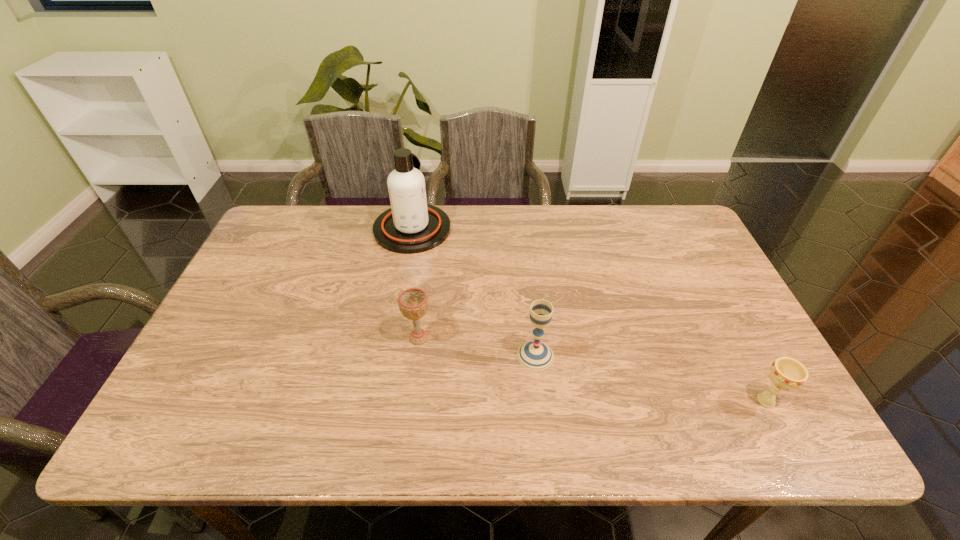
At what (x,y) coordinates should I click in order to perform the action: click on object present at the far edge. Please return your answer as a coordinate pair (x, y). The width and height of the screenshot is (960, 540). Looking at the image, I should click on (410, 226).

The height and width of the screenshot is (540, 960). What are the coordinates of `object that is positioned at the near edge` in the screenshot? It's located at (786, 373).

This screenshot has width=960, height=540. What are the coordinates of `object present at the right edge` in the screenshot? It's located at (786, 373).

I want to click on object at the near right corner, so click(x=786, y=373).

The width and height of the screenshot is (960, 540). Identify the location of vacant space at the far edge of the desktop. (563, 218).

Identify the location of free space at the near edge of the desktop. (541, 426).

At what (x,y) coordinates should I click in order to perform the action: click on free space at the left edge of the desktop. Please return your answer as a coordinate pair (x, y). The width and height of the screenshot is (960, 540). Looking at the image, I should click on (265, 252).

I want to click on vacant area at the right edge, so click(x=682, y=296).

In the image, there is a desktop. Identify the location of vacant space at the far left corner. This screenshot has width=960, height=540. (293, 234).

In the image, there is a desktop. What are the coordinates of `free space at the far right corner` in the screenshot? It's located at (686, 250).